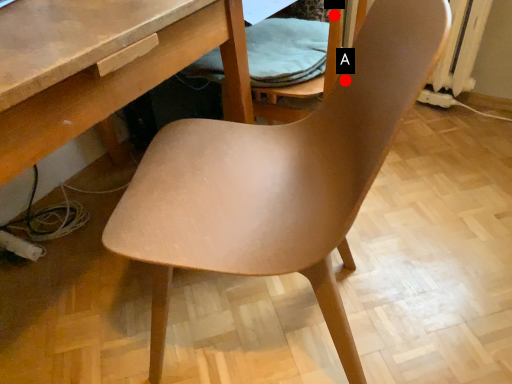
Question: Two points are circled on the image, labeled by A and B beside each circle. Among these points, which one is nearest to the camera?

Choices:
 (A) A is closer
 (B) B is closer

Answer: (A)